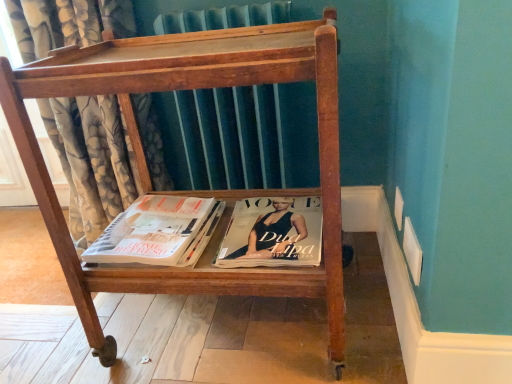
Question: Is wooden magazine rack at center oriented towards floral fabric curtain at left?

Choices:
 (A) no
 (B) yes

Answer: (A)

Question: From the image's perspective, does wooden magazine rack at center appear higher than floral fabric curtain at left?

Choices:
 (A) no
 (B) yes

Answer: (A)

Question: Is wooden magazine rack at center bigger than floral fabric curtain at left?

Choices:
 (A) no
 (B) yes

Answer: (A)

Question: Considering the relative sizes of wooden magazine rack at center and floral fabric curtain at left in the image provided, is wooden magazine rack at center taller than floral fabric curtain at left?

Choices:
 (A) no
 (B) yes

Answer: (A)

Question: Is floral fabric curtain at left inside wooden magazine rack at center?

Choices:
 (A) no
 (B) yes

Answer: (A)

Question: Is wooden magazine rack at center outside floral fabric curtain at left?

Choices:
 (A) yes
 (B) no

Answer: (A)

Question: Is matte black magazine at center at the back of wooden magazine rack at center?

Choices:
 (A) no
 (B) yes

Answer: (B)

Question: Is the surface of wooden magazine rack at center in direct contact with matte black magazine at center?

Choices:
 (A) no
 (B) yes

Answer: (A)

Question: Is wooden magazine rack at center far away from matte black magazine at center?

Choices:
 (A) yes
 (B) no

Answer: (B)

Question: Is wooden magazine rack at center shorter than matte black magazine at center?

Choices:
 (A) no
 (B) yes

Answer: (A)

Question: From the image's perspective, is wooden magazine rack at center on matte black magazine at center?

Choices:
 (A) no
 (B) yes

Answer: (B)

Question: Considering the relative positions of wooden magazine rack at center and matte black magazine at center in the image provided, is wooden magazine rack at center to the left of matte black magazine at center from the viewer's perspective?

Choices:
 (A) yes
 (B) no

Answer: (A)

Question: Considering the relative sizes of floral fabric curtain at left and wooden magazine rack at center in the image provided, is floral fabric curtain at left wider than wooden magazine rack at center?

Choices:
 (A) no
 (B) yes

Answer: (B)